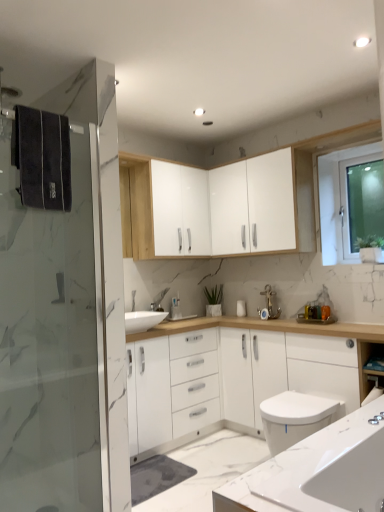
Question: Could transparent glass screen door at left be considered to be inside white glossy cabinet at upper center, positioned as the 2th cabinetry in left-to-right order?

Choices:
 (A) yes
 (B) no

Answer: (B)

Question: From a real-world perspective, is white glossy cabinet at upper center, the first cabinetry from the right, positioned over transparent glass screen door at left based on gravity?

Choices:
 (A) yes
 (B) no

Answer: (A)

Question: Is white glossy cabinet at upper center, the first cabinetry from the right, smaller than transparent glass screen door at left?

Choices:
 (A) yes
 (B) no

Answer: (B)

Question: Is white glossy cabinet at upper center, positioned as the 2th cabinetry in left-to-right order, not near transparent glass screen door at left?

Choices:
 (A) no
 (B) yes

Answer: (B)

Question: From the image's perspective, is white glossy cabinet at upper center, positioned as the 2th cabinetry in left-to-right order, located beneath transparent glass screen door at left?

Choices:
 (A) no
 (B) yes

Answer: (A)

Question: Is white glossy cabinet at upper center, positioned as the 2th cabinetry in left-to-right order, oriented towards transparent glass screen door at left?

Choices:
 (A) yes
 (B) no

Answer: (A)

Question: Is white marble countertop at lower right looking in the opposite direction of white glossy cabinet at lower right?

Choices:
 (A) yes
 (B) no

Answer: (B)

Question: Can you confirm if white marble countertop at lower right is bigger than white glossy cabinet at lower right?

Choices:
 (A) yes
 (B) no

Answer: (B)

Question: Considering the relative sizes of white marble countertop at lower right and white glossy cabinet at lower right in the image provided, is white marble countertop at lower right wider than white glossy cabinet at lower right?

Choices:
 (A) no
 (B) yes

Answer: (B)

Question: Does white marble countertop at lower right touch white glossy cabinet at lower right?

Choices:
 (A) yes
 (B) no

Answer: (B)

Question: Is white marble countertop at lower right positioned far away from white glossy cabinet at lower right?

Choices:
 (A) no
 (B) yes

Answer: (B)

Question: Does white marble countertop at lower right come behind white glossy cabinet at lower right?

Choices:
 (A) no
 (B) yes

Answer: (A)

Question: Can you confirm if white glossy cabinet at upper center, which is the 2th cabinetry in right-to-left order, is shorter than white glossy cabinet at upper center, positioned as the 2th cabinetry in left-to-right order?

Choices:
 (A) yes
 (B) no

Answer: (B)